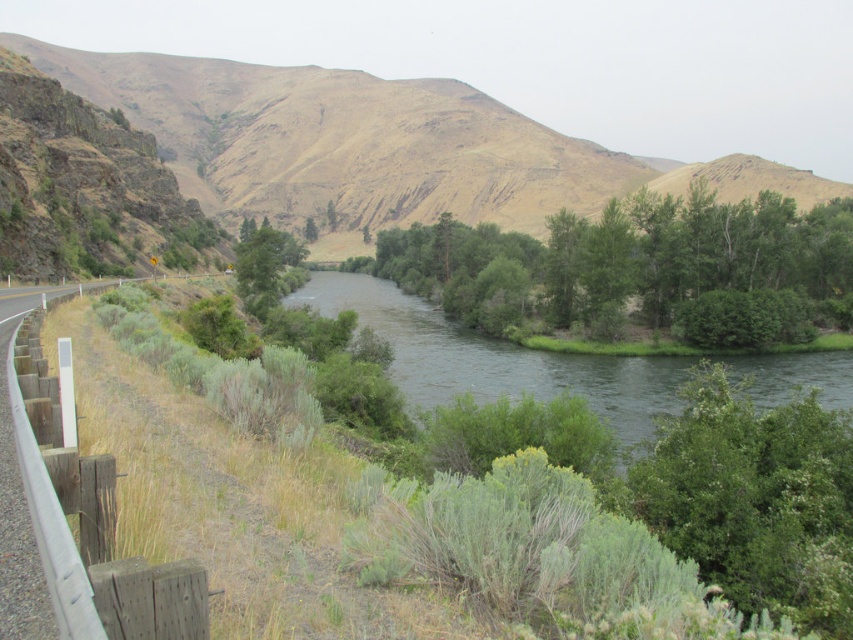
Question: Can you confirm if green leafy trees at center is positioned to the right of green leafy river at center?

Choices:
 (A) no
 (B) yes

Answer: (B)

Question: Which of the following is the closest to the observer?

Choices:
 (A) green leafy river at center
 (B) brown/drymountain at upper center
 (C) green leafy tree at center
 (D) green leafy trees at center

Answer: (A)

Question: Is brown/drymountain at upper center in front of green leafy river at center?

Choices:
 (A) yes
 (B) no

Answer: (B)

Question: Considering the relative positions of green leafy trees at center and green leafy tree at center in the image provided, where is green leafy trees at center located with respect to green leafy tree at center?

Choices:
 (A) right
 (B) left

Answer: (A)

Question: Which point appears farthest from the camera in this image?

Choices:
 (A) (155, 84)
 (B) (699, 196)
 (C) (283, 264)
 (D) (592, 376)

Answer: (A)

Question: Among these objects, which one is farthest from the camera?

Choices:
 (A) green leafy river at center
 (B) brown/drymountain at upper center
 (C) green leafy tree at center
 (D) green leafy trees at center

Answer: (B)